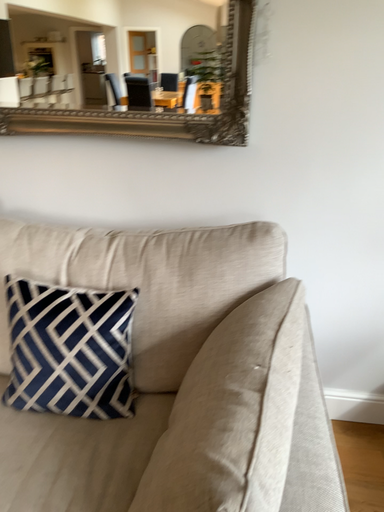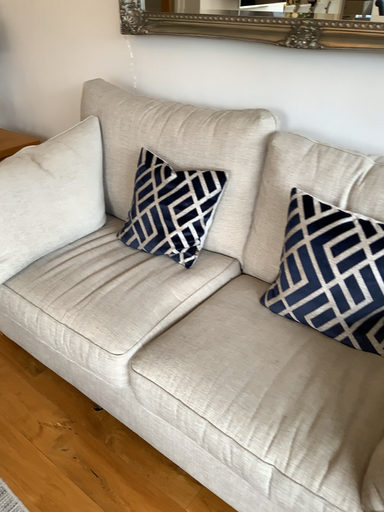
Question: How did the camera likely rotate when shooting the video?

Choices:
 (A) rotated right
 (B) rotated left

Answer: (B)